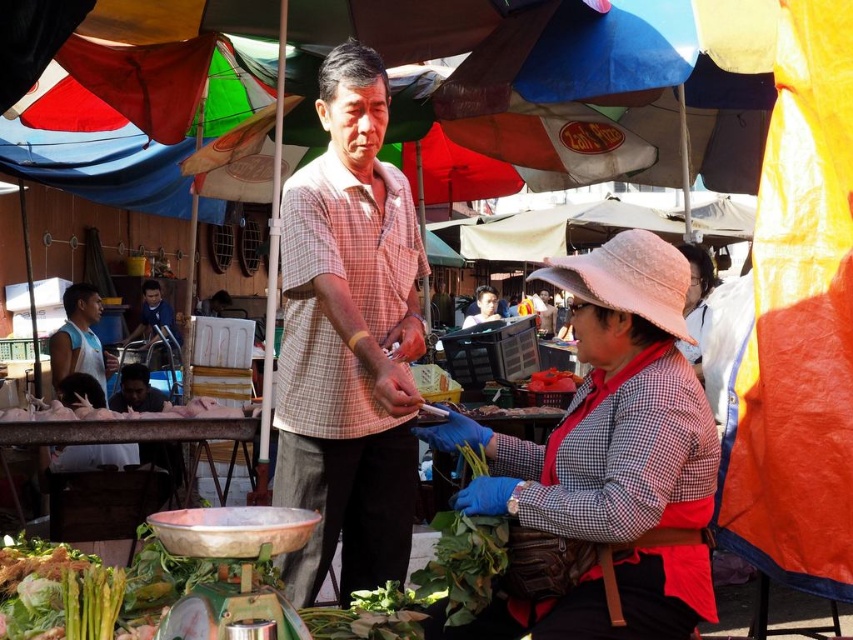
You are standing at the market and want to take a photo of the point at coordinates (x=149, y=324). If your camera has a maximum focus range of 10 meters, will it be able to focus on that point?

The distance of point (x=149, y=324) from the camera is 9.67 meters, which is within the camera maximum focus range of 10 meters. So yes, the camera can focus on that point.

In the market scene, there are two men wearing different shirts. The first is wearing a plaid shirt at center and the other a light blue sleeveless shirt at left. Which shirt is bigger in size?

The plaid shirt at center is larger in size compared to the light blue sleeveless shirt at left.

You are a photographer trying to capture a shot of the pink fabric hat at upper center and the light blue sleeveless shirt at left. If you want to ensure both subjects are fully visible in your frame, which object should you position closer to the camera?

The pink fabric hat at upper center should be positioned closer to the camera because it might be wider than the light blue sleeveless shirt at left, ensuring both fit within the frame.